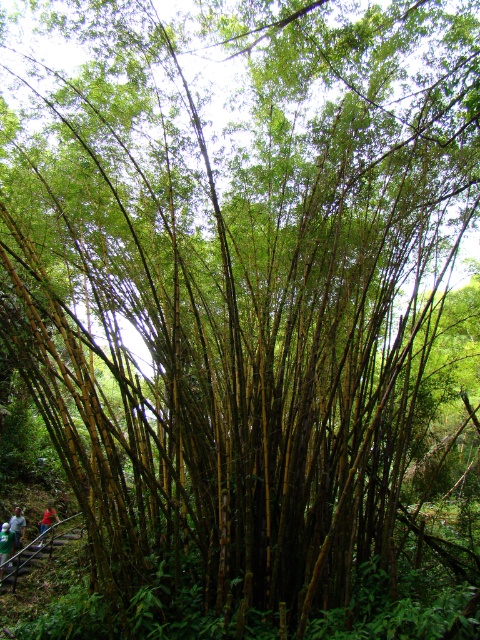
What do you see at coordinates (6, 545) in the screenshot? The width and height of the screenshot is (480, 640). I see `green fabric person at lower left` at bounding box center [6, 545].

Consider the image. Between green fabric person at lower left and red fabric person at lower left, which one appears on the left side from the viewer's perspective?

From the viewer's perspective, green fabric person at lower left appears more on the left side.

The image size is (480, 640). What do you see at coordinates (6, 545) in the screenshot? I see `green fabric person at lower left` at bounding box center [6, 545].

The width and height of the screenshot is (480, 640). I want to click on green fabric person at lower left, so click(6, 545).

Does green fabric shirt at lower left appear over red fabric person at lower left?

Yes.

Who is lower down, green fabric shirt at lower left or red fabric person at lower left?

red fabric person at lower left is lower down.

The image size is (480, 640). What do you see at coordinates (16, 528) in the screenshot?
I see `green fabric shirt at lower left` at bounding box center [16, 528].

Find the location of a particular element. The image size is (480, 640). green fabric shirt at lower left is located at coordinates (16, 528).

Who is higher up, green fabric person at lower left or green fabric shirt at lower left?

green fabric shirt at lower left is above.

Does green fabric person at lower left have a lesser width compared to green fabric shirt at lower left?

Indeed, green fabric person at lower left has a lesser width compared to green fabric shirt at lower left.

Is point (12, 538) closer to viewer compared to point (20, 529)?

That is True.

Identify the location of green fabric person at lower left. (6, 545).